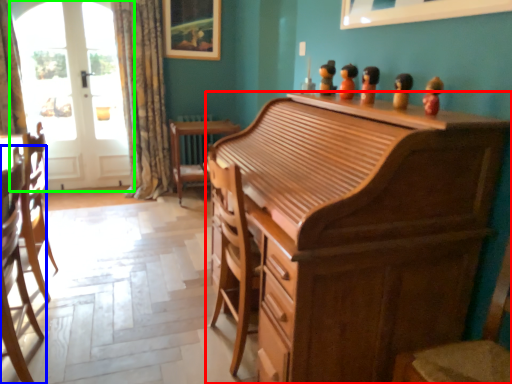
Question: Which object is the farthest from cabinetry (highlighted by a red box)? Choose among these: chair (highlighted by a blue box) or screen door (highlighted by a green box).

Choices:
 (A) chair
 (B) screen door

Answer: (B)